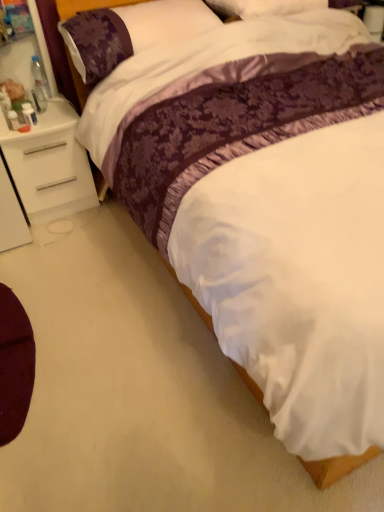
You are a GUI agent. You are given a task and a screenshot of the screen. Output one action in this format:
    pyautogui.click(x=<x>, y=<y>)
    Task: Click on the vacant point above maroon fabric cushion at lower left (from a real-world perspective)
    This screenshot has width=384, height=512.
    Given the screenshot: What is the action you would take?
    pyautogui.click(x=14, y=343)